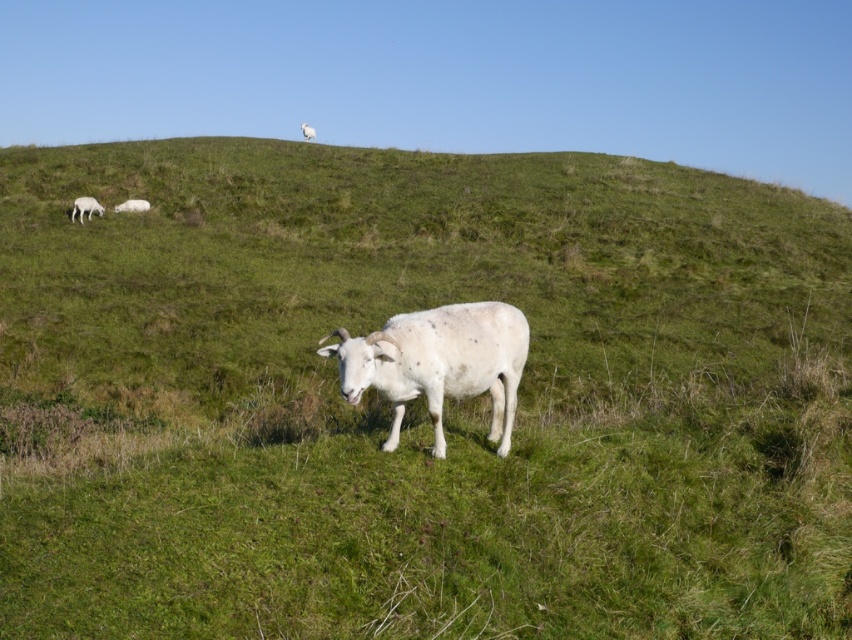
You are standing at the origin point of the image. There is a white woolly sheep at upper left located at point (131,205). If you want to walk towards the white woolly sheep at upper left, which direction should you face?

You should face the upper left direction to walk towards the white woolly sheep at upper left located at point (131,205).

You are standing at the center of the image. Which direction should you move to reach the white woolly sheep at left?

You should move to the left to reach the white woolly sheep at left since it is located at the left side of the image.